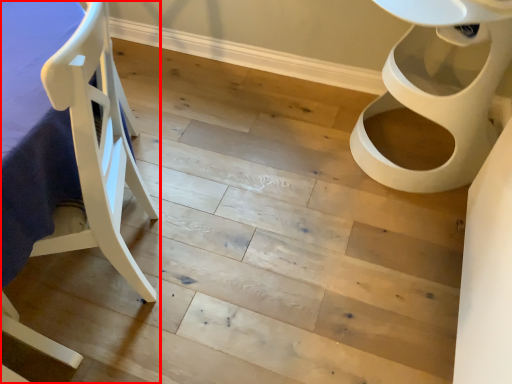
Question: Where is furniture (annotated by the red box) located in relation to toilet in the image?

Choices:
 (A) right
 (B) left

Answer: (B)